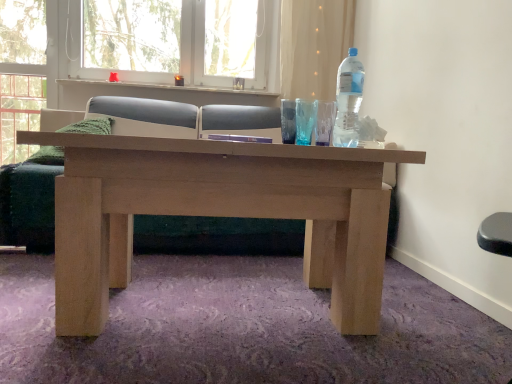
Find the location of a particular element. vacant space underneath white plastic window frame at upper center (from a real-world perspective) is located at coordinates (173, 85).